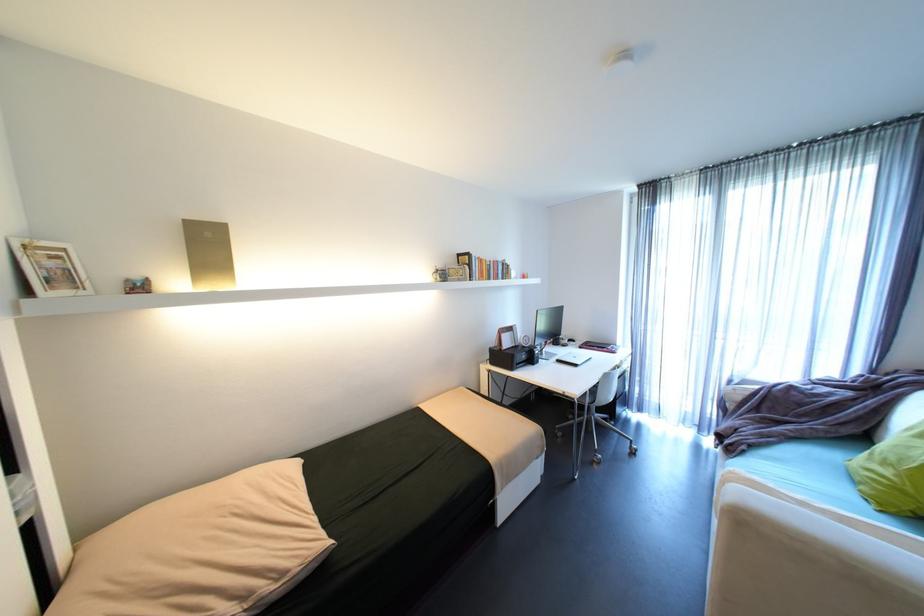
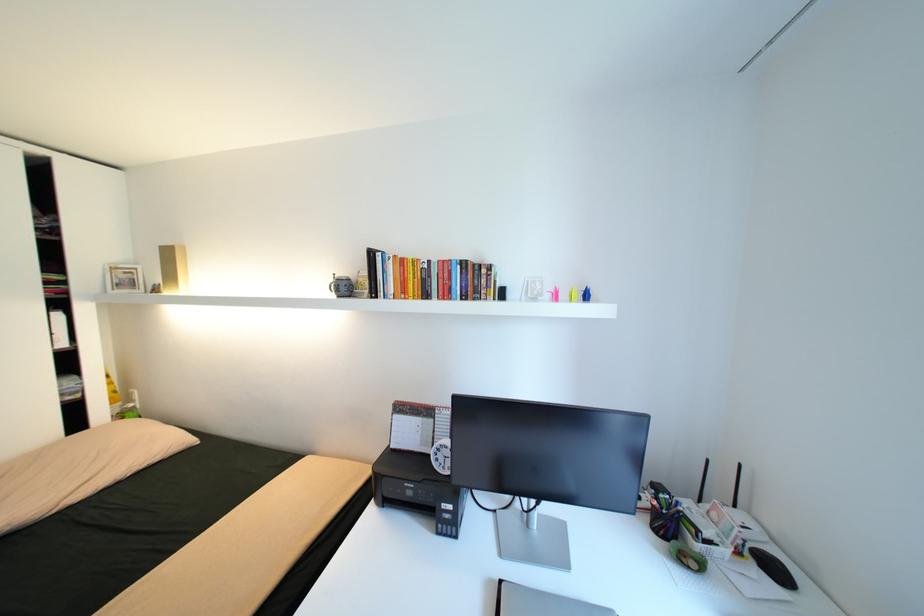
In the second image, find the point that corresponds to point (500, 262) in the first image.

(445, 262)